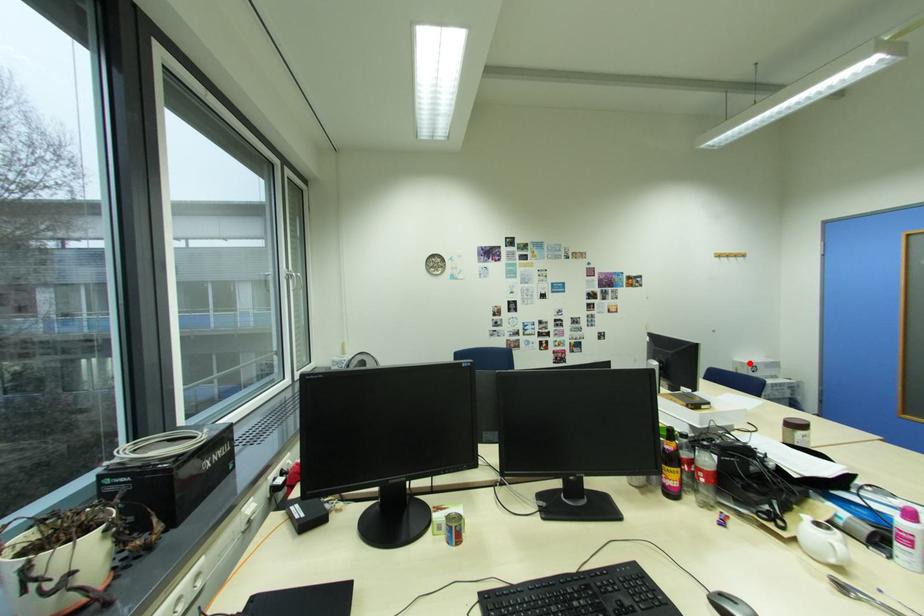
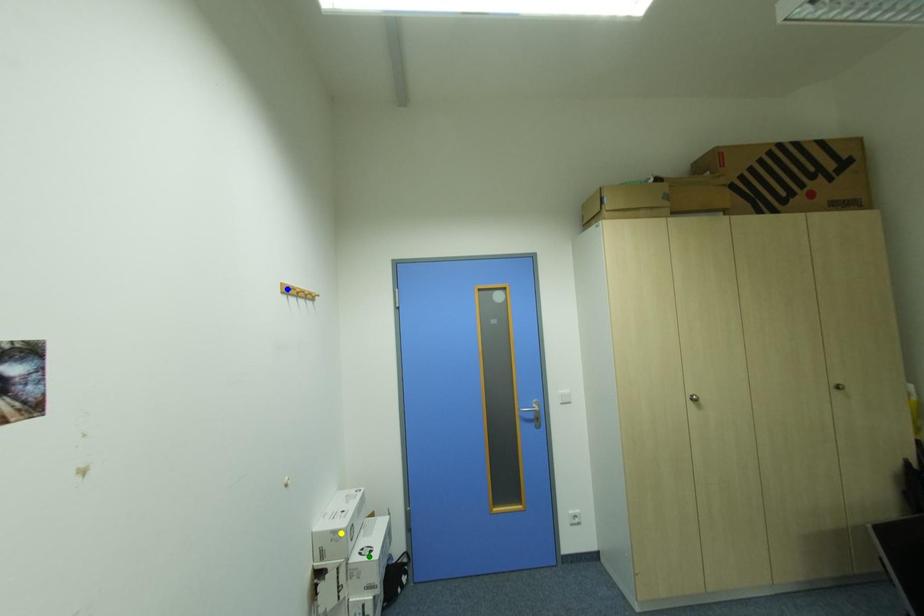
Question: I am providing you with two images of the same scene from different viewpoints. A red point is marked on the first image. You are given multiple points on the second image. Which point in image 2 is actually the same real-world point as the red point in image 1?

Choices:
 (A) blue point
 (B) yellow point
 (C) green point

Answer: (B)